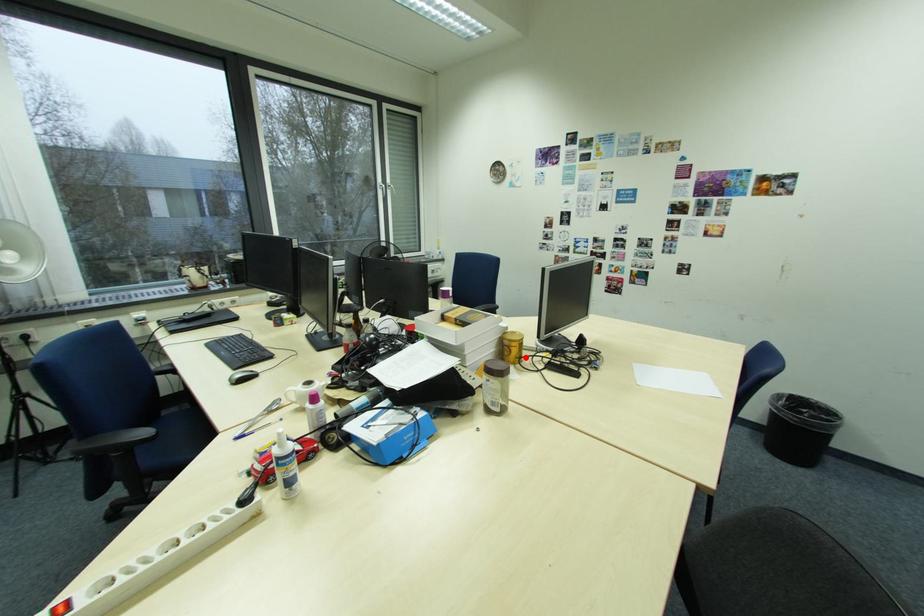
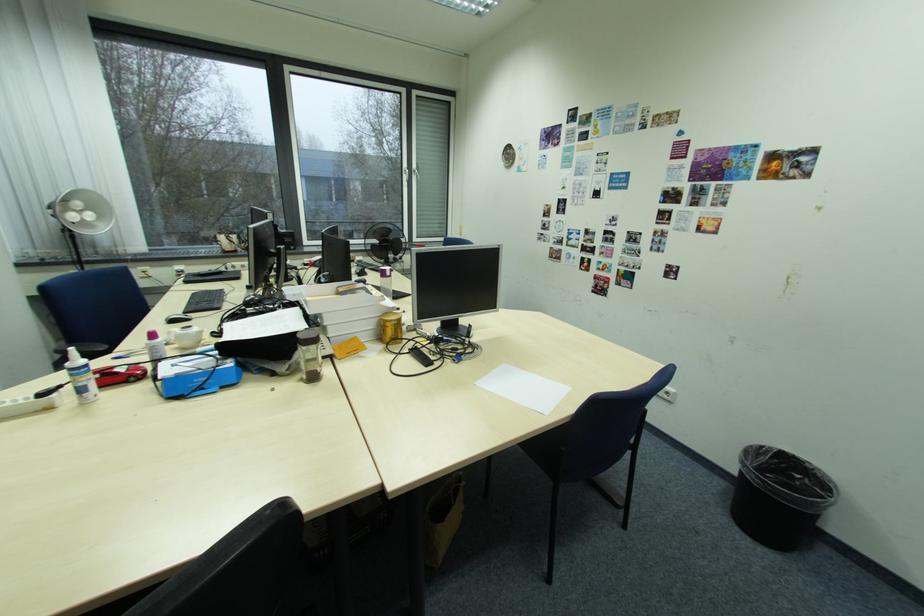
Find the pixel in the second image that matches the highlighted location in the first image.

(400, 339)